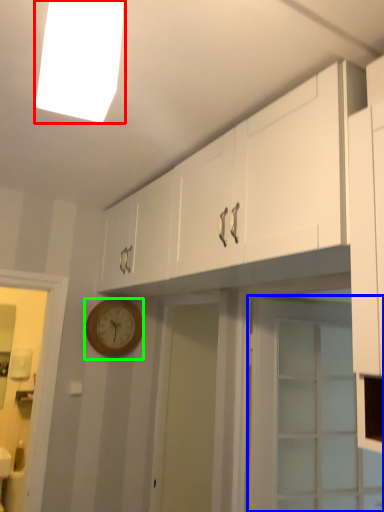
Question: Estimate the real-world distances between objects in this image. Which object is farther from lighting (highlighted by a red box), door (highlighted by a blue box) or wall clock (highlighted by a green box)?

Choices:
 (A) door
 (B) wall clock

Answer: (B)